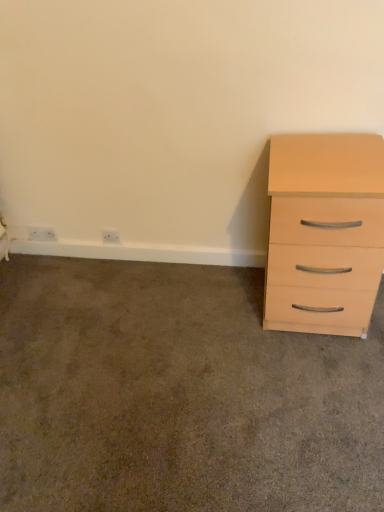
I want to click on vacant area on top of light wood/finish chest of drawers at right (from a real-world perspective), so click(333, 156).